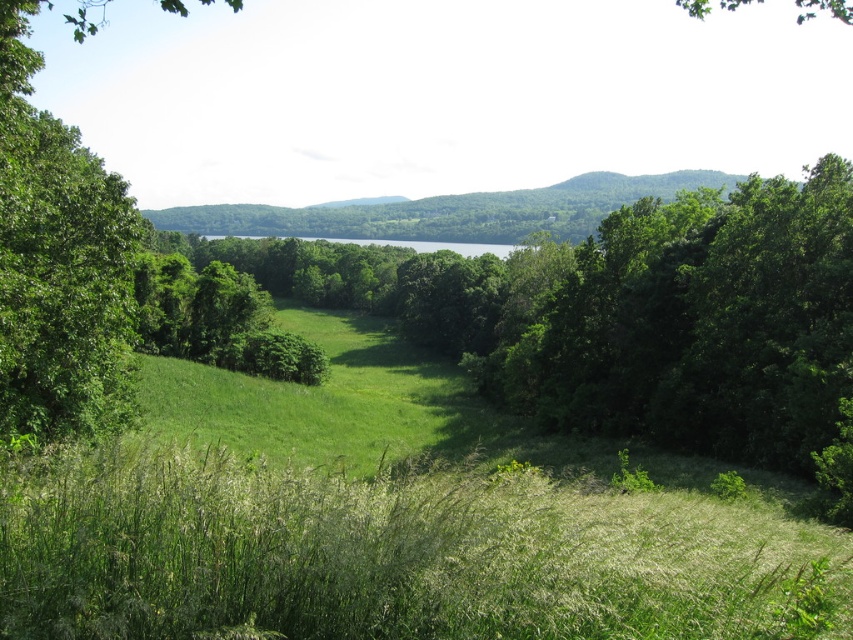
In the scene shown: Does green grassy hillside at center have a smaller size compared to green grassy field at center?

No.

Can you confirm if green grassy hillside at center is bigger than green grassy field at center?

Yes, green grassy hillside at center is bigger than green grassy field at center.

At what (x,y) coordinates should I click in order to perform the action: click on green grassy hillside at center. Please return your answer as a coordinate pair (x, y). The width and height of the screenshot is (853, 640). Looking at the image, I should click on (448, 211).

In order to click on green grassy hillside at center in this screenshot , I will do `click(448, 211)`.